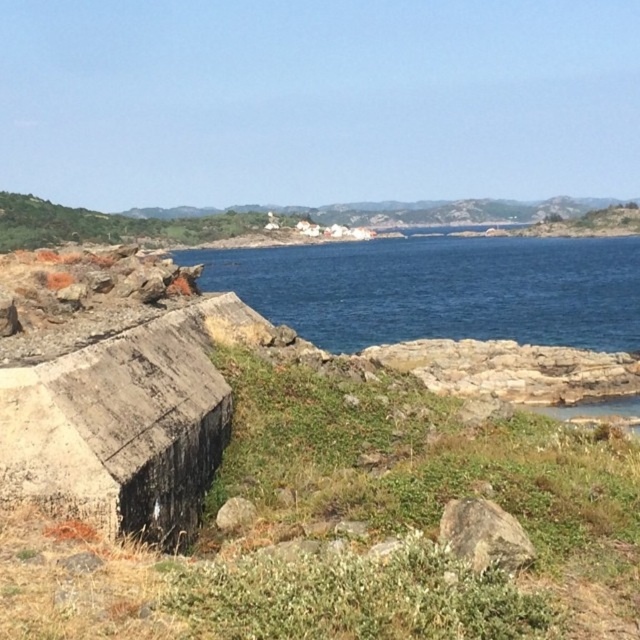
You are a geologist examining the coastal area. You notice two rocks in the scene. Which one is taller between the brown rough rock at center and the gray rough stone at center?

The brown rough rock at center is taller than the gray rough stone at center according to the description.

You are standing at the rugged terrain in the foreground of the coastal landscape and want to take a photo. There are two points marked as point 1 at coordinates point (352, 326) and point 2 at coordinates point (246, 509). Which point is closer to your current position?

Point 1 at coordinates point (352, 326) is closer to your current position because it is further to the camera than point 2 at coordinates point (246, 509).

You are standing on the rugged terrain and see the brown rough rock at center and the gray rough stone at center. Which one is more to the right?

The brown rough rock at center is more to the right because it is positioned on the right side of the gray rough stone at center.